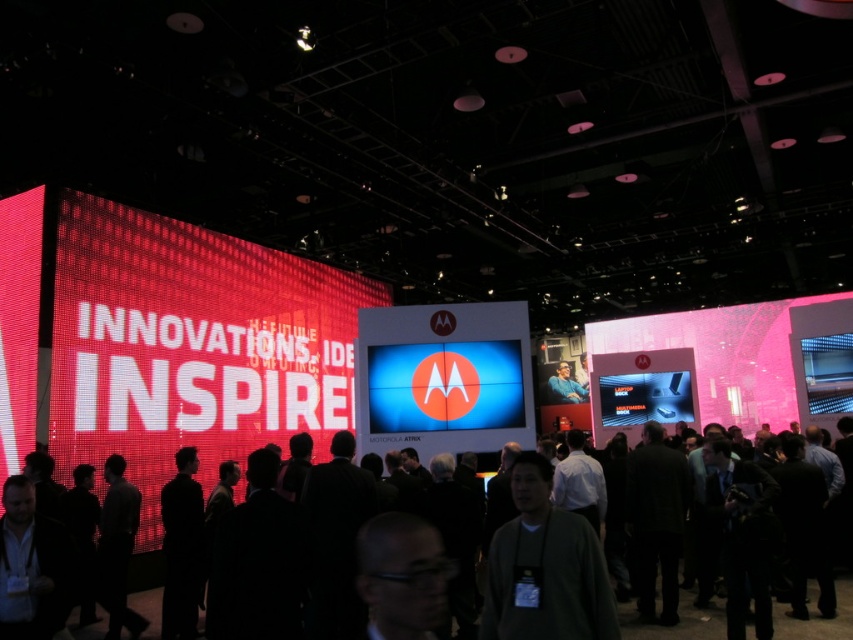
Between point (633, 378) and point (563, 374), which one is positioned in front?

Point (633, 378) is in front.

Locate an element on the screen. The height and width of the screenshot is (640, 853). metallic silver phone at center is located at coordinates (645, 397).

Is black fabric crowd at center above blue fabric shirt at center?

No, black fabric crowd at center is not above blue fabric shirt at center.

Is black fabric crowd at center further to camera compared to blue fabric shirt at center?

No.

Who is more distant from viewer, (688,630) or (577,390)?

Point (577,390)

The width and height of the screenshot is (853, 640). I want to click on black fabric crowd at center, so click(x=677, y=624).

In the scene shown: Who is more forward, (x=682, y=374) or (x=804, y=344)?

Point (x=804, y=344)

Is metallic silver phone at center to the left of metallic blue screen at upper right from the viewer's perspective?

Indeed, metallic silver phone at center is positioned on the left side of metallic blue screen at upper right.

Which is in front, point (628, 394) or point (825, 336)?

Positioned in front is point (825, 336).

The image size is (853, 640). I want to click on metallic silver phone at center, so [645, 397].